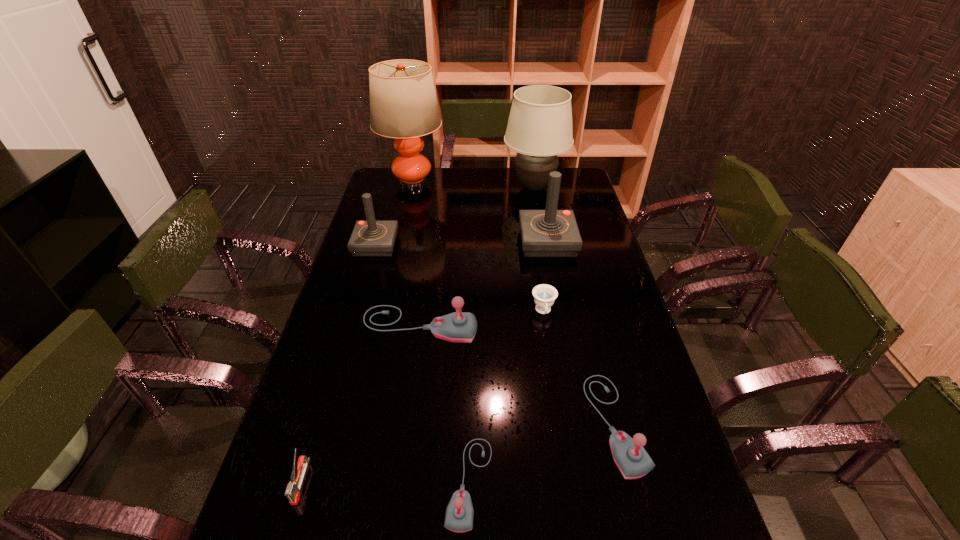
At what (x,y) coordinates should I click in order to perform the action: click on lampshade located in the right edge section of the desktop. Please return your answer as a coordinate pair (x, y). This screenshot has width=960, height=540. Looking at the image, I should click on (539, 128).

You are a GUI agent. You are given a task and a screenshot of the screen. Output one action in this format:
    pyautogui.click(x=<x>, y=<y>)
    Task: Click on the object situated at the far left corner
    This screenshot has width=960, height=540.
    Given the screenshot: What is the action you would take?
    pyautogui.click(x=403, y=104)

Where is `object at the far right corner`? object at the far right corner is located at coordinates (539, 128).

Locate an element on the screen. The height and width of the screenshot is (540, 960). free space at the far edge is located at coordinates (458, 192).

Where is `free location at the right edge`? This screenshot has width=960, height=540. free location at the right edge is located at coordinates (593, 369).

Find the location of a particular element. The image size is (960, 540). vacant area that lies between the third tallest joystick and the lampshade is located at coordinates (477, 256).

Find the location of a particular element. vacant area that lies between the stapler and the seventh shortest object is located at coordinates (424, 362).

Find the location of a particular element. vacant region between the shortest object and the second tallest joystick is located at coordinates (460, 278).

The image size is (960, 540). Identify the location of vacant region between the sixth shortest object and the lamp. (394, 214).

At what (x,y) coordinates should I click in order to perform the action: click on vacant space that is in between the lamp and the second tallest object. Please return your answer as a coordinate pair (x, y). The height and width of the screenshot is (540, 960). Looking at the image, I should click on (473, 185).